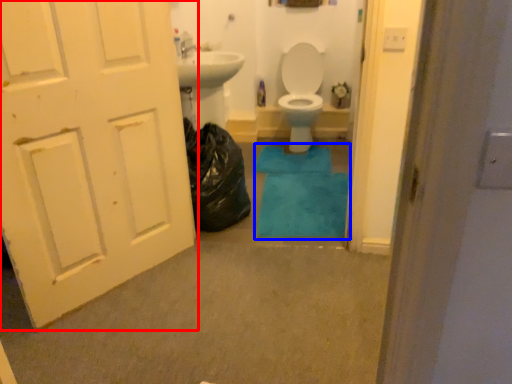
Question: Among these objects, which one is nearest to the camera, door (highlighted by a red box) or bath mat (highlighted by a blue box)?

Choices:
 (A) door
 (B) bath mat

Answer: (A)